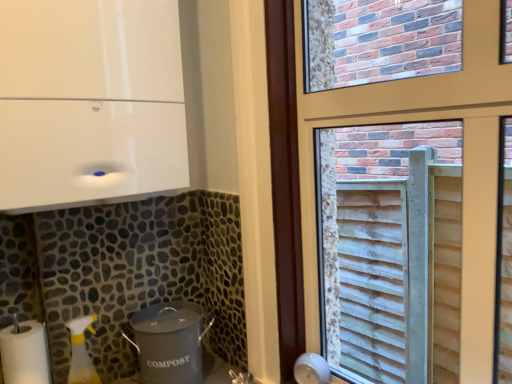
Question: From a real-world perspective, is gray matte compost bin at lower center, the 2th appliance viewed from the top, physically below white matte paper towel at lower left?

Choices:
 (A) yes
 (B) no

Answer: (A)

Question: From the image's perspective, is gray matte compost bin at lower center, which is counted as the 1th appliance, starting from the bottom, on top of white matte paper towel at lower left?

Choices:
 (A) yes
 (B) no

Answer: (A)

Question: Does gray matte compost bin at lower center, the 2th appliance viewed from the top, appear on the right side of white matte paper towel at lower left?

Choices:
 (A) yes
 (B) no

Answer: (A)

Question: Does gray matte compost bin at lower center, which is counted as the 1th appliance, starting from the bottom, come in front of white matte paper towel at lower left?

Choices:
 (A) yes
 (B) no

Answer: (B)

Question: From the image's perspective, would you say gray matte compost bin at lower center, which is counted as the 1th appliance, starting from the bottom, is shown under white matte paper towel at lower left?

Choices:
 (A) yes
 (B) no

Answer: (B)

Question: Is gray matte compost bin at lower center, which is counted as the 1th appliance, starting from the bottom, oriented away from white matte paper towel at lower left?

Choices:
 (A) yes
 (B) no

Answer: (B)

Question: Is white matte paper towel at lower left with gray matte compost bin at lower center, the 2th appliance viewed from the top?

Choices:
 (A) no
 (B) yes

Answer: (A)

Question: Does white matte paper towel at lower left come behind gray matte compost bin at lower center, the 2th appliance viewed from the top?

Choices:
 (A) no
 (B) yes

Answer: (A)

Question: Is gray matte compost bin at lower center, which is counted as the 1th appliance, starting from the bottom, a part of white matte paper towel at lower left?

Choices:
 (A) no
 (B) yes

Answer: (A)

Question: Is white matte paper towel at lower left facing away from gray matte compost bin at lower center, the 2th appliance viewed from the top?

Choices:
 (A) no
 (B) yes

Answer: (A)

Question: Would you say white matte paper towel at lower left is outside gray matte compost bin at lower center, which is counted as the 1th appliance, starting from the bottom?

Choices:
 (A) yes
 (B) no

Answer: (A)

Question: From a real-world perspective, is white matte paper towel at lower left under gray matte compost bin at lower center, the 2th appliance viewed from the top?

Choices:
 (A) no
 (B) yes

Answer: (A)

Question: Does gray matte compost bin at lower center, the 2th appliance viewed from the top, turn towards wooden slats at right?

Choices:
 (A) yes
 (B) no

Answer: (B)